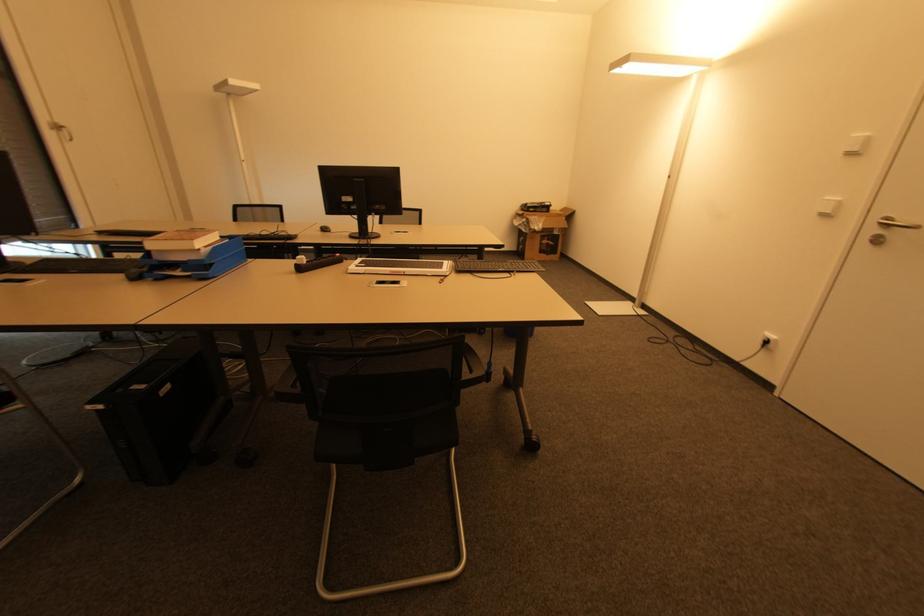
At what (x,y) coordinates should I click in order to perform the action: click on silver door handle. Please return your answer as a coordinate pair (x, y). Looking at the image, I should click on (894, 225).